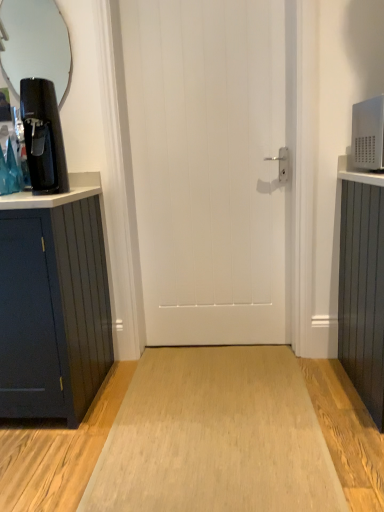
Question: Is clear glass mirror at upper left at the right side of matte black coffee machine at left?

Choices:
 (A) no
 (B) yes

Answer: (A)

Question: Is clear glass mirror at upper left aimed at matte black coffee machine at left?

Choices:
 (A) yes
 (B) no

Answer: (A)

Question: Does clear glass mirror at upper left lie behind matte black coffee machine at left?

Choices:
 (A) no
 (B) yes

Answer: (B)

Question: From the image's perspective, is clear glass mirror at upper left located beneath matte black coffee machine at left?

Choices:
 (A) no
 (B) yes

Answer: (A)

Question: Considering the relative positions of clear glass mirror at upper left and matte black coffee machine at left in the image provided, is clear glass mirror at upper left to the left of matte black coffee machine at left from the viewer's perspective?

Choices:
 (A) yes
 (B) no

Answer: (A)

Question: Based on their positions, is matte black coffee machine at left located to the left or right of clear glass mirror at upper left?

Choices:
 (A) right
 (B) left

Answer: (A)

Question: From a real-world perspective, is matte black coffee machine at left positioned above or below clear glass mirror at upper left?

Choices:
 (A) below
 (B) above

Answer: (A)

Question: Is matte black coffee machine at left in front of or behind clear glass mirror at upper left in the image?

Choices:
 (A) front
 (B) behind

Answer: (A)

Question: From the image's perspective, relative to clear glass mirror at upper left, is matte black coffee machine at left above or below?

Choices:
 (A) below
 (B) above

Answer: (A)

Question: Considering the positions of white matte door at center and light wood floor at center in the image, is white matte door at center bigger or smaller than light wood floor at center?

Choices:
 (A) small
 (B) big

Answer: (B)

Question: Is white matte door at center taller or shorter than light wood floor at center?

Choices:
 (A) short
 (B) tall

Answer: (B)

Question: Is white matte door at center to the left or to the right of light wood floor at center in the image?

Choices:
 (A) left
 (B) right

Answer: (A)

Question: Do you think white matte door at center is within light wood floor at center, or outside of it?

Choices:
 (A) outside
 (B) inside

Answer: (A)

Question: Would you say light wood floor at center is to the left or to the right of white matte door at center in the picture?

Choices:
 (A) right
 (B) left

Answer: (A)

Question: Looking at their shapes, would you say light wood floor at center is wider or thinner than white matte door at center?

Choices:
 (A) thin
 (B) wide

Answer: (B)